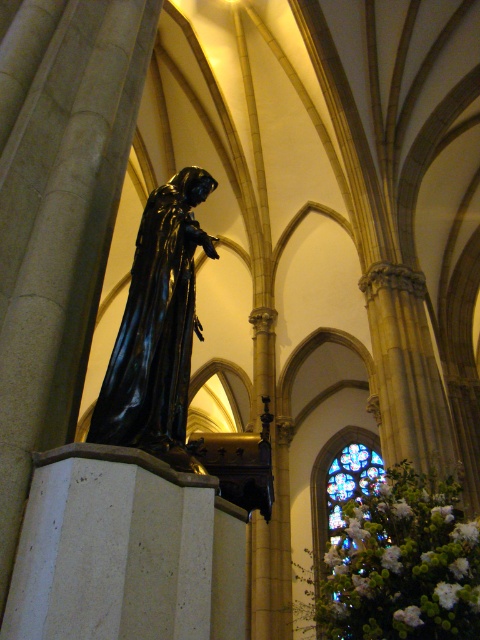
You are an architect designing a new cathedral and want to ensure that the shiny black statue at center and the stained glass window at center are proportionate. Given their widths, which object should be placed closer to the entrance to maintain visual balance?

The shiny black statue at center is narrower than the stained glass window at center. To maintain visual balance, the narrower statue should be placed closer to the entrance, while the wider stained glass window at center can be positioned further back.

You are a maintenance worker in the cathedral. You need to clean both the shiny black statue at center and the stained glass window at center. The ladder you have can reach up to 200 feet. Can you reach both objects with the same ladder?

The shiny black statue at center and stained glass window at center are 228.33 feet apart from each other. Since the ladder can only reach up to 200 feet, you cannot reach both objects with the same ladder because the distance between them exceeds the ladder height limit.

You are standing inside the cathedral and looking up at the ceiling. There is a shiny black statue at center. Where exactly is the shiny black statue located in relation to the point marked at coordinates point (157, 328)?

The point (157, 328) marks the shiny black statue at center, so it is exactly at that location.